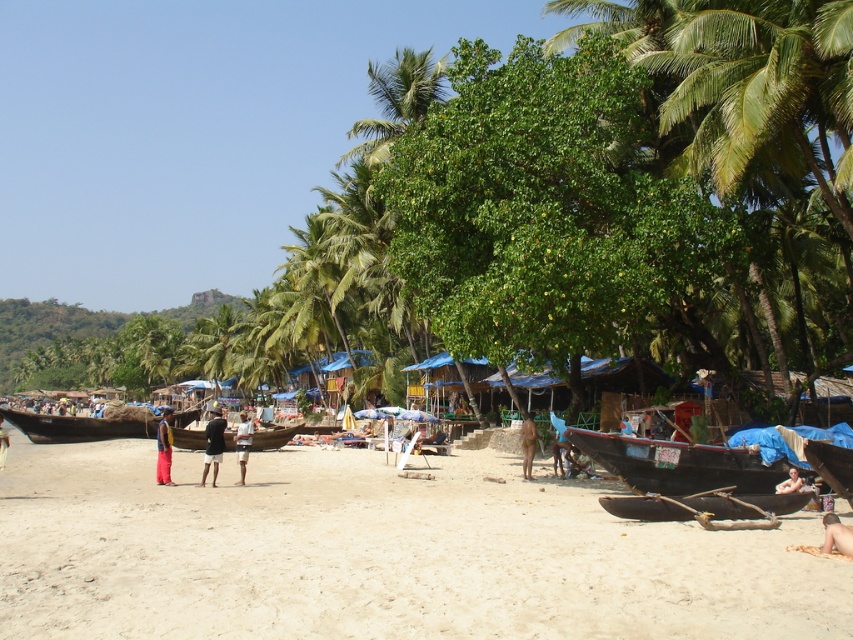
Question: Does yellow fabric pants at center appear on the right side of light brown fabric shorts at center?

Choices:
 (A) no
 (B) yes

Answer: (A)

Question: Which point is farther to the camera?

Choices:
 (A) (155, 472)
 (B) (683, 490)
 (C) (212, 440)

Answer: (A)

Question: Can you confirm if tan skin human at lower right is positioned above dark brown leather shorts at center?

Choices:
 (A) yes
 (B) no

Answer: (A)

Question: Which point appears farthest from the camera in this image?

Choices:
 (A) (74, 436)
 (B) (521, 426)

Answer: (A)

Question: Is black cotton shorts at center behind yellow fabric pants at center?

Choices:
 (A) no
 (B) yes

Answer: (A)

Question: Among these objects, which one is nearest to the camera?

Choices:
 (A) light brown skin at lower right
 (B) dark brown wooden boat at lower right
 (C) brown wooden canoe at lower right

Answer: (C)